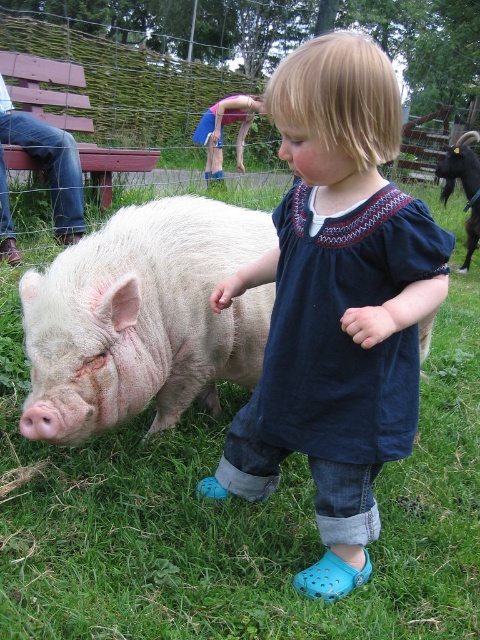
Question: Which of the following is the farthest from the observer?

Choices:
 (A) green grass at center
 (B) black glossy goat at right

Answer: (B)

Question: From the image, what is the correct spatial relationship of green grass at center in relation to blue denim shorts at center?

Choices:
 (A) above
 (B) below

Answer: (B)

Question: Which object appears closest to the camera in this image?

Choices:
 (A) blue denim shorts at center
 (B) blue denim dress at center
 (C) green grass at center

Answer: (B)

Question: Can you confirm if blue denim shorts at center is bigger than black glossy goat at right?

Choices:
 (A) no
 (B) yes

Answer: (B)

Question: Is green grass at center positioned at the back of black glossy goat at right?

Choices:
 (A) yes
 (B) no

Answer: (B)

Question: Estimate the real-world distances between objects in this image. Which object is closer to the white furry pig at center?

Choices:
 (A) blue denim shorts at center
 (B) green grass at center
 (C) blue denim dress at center

Answer: (C)